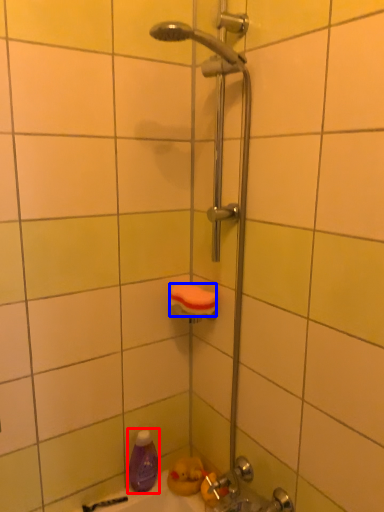
Question: Which object is closer to the camera taking this photo, cleaning product (highlighted by a red box) or towel bar (highlighted by a blue box)?

Choices:
 (A) cleaning product
 (B) towel bar

Answer: (B)